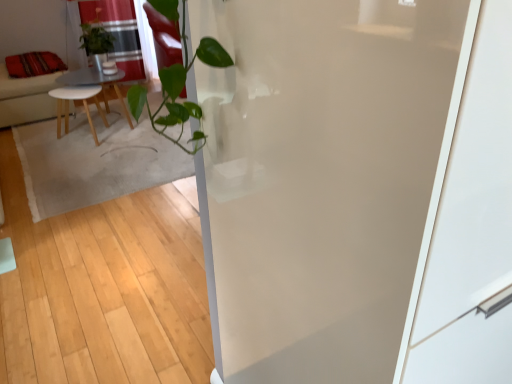
Question: Does wooden table at center come behind red fabric cushion at left?

Choices:
 (A) yes
 (B) no

Answer: (B)

Question: Is wooden table at center thinner than red fabric cushion at left?

Choices:
 (A) yes
 (B) no

Answer: (A)

Question: Is red fabric cushion at left a part of wooden table at center?

Choices:
 (A) no
 (B) yes

Answer: (A)

Question: From the image's perspective, does wooden table at center appear higher than red fabric cushion at left?

Choices:
 (A) yes
 (B) no

Answer: (B)

Question: Is the depth of wooden table at center less than that of red fabric cushion at left?

Choices:
 (A) no
 (B) yes

Answer: (B)

Question: Is point (110, 77) positioned closer to the camera than point (279, 117)?

Choices:
 (A) closer
 (B) farther

Answer: (B)

Question: Is wooden table at center bigger or smaller than transparent glass screen door at center?

Choices:
 (A) small
 (B) big

Answer: (A)

Question: In the image, is wooden table at center positioned in front of or behind transparent glass screen door at center?

Choices:
 (A) behind
 (B) front

Answer: (A)

Question: Which is correct: wooden table at center is inside transparent glass screen door at center, or outside of it?

Choices:
 (A) inside
 (B) outside

Answer: (B)

Question: From a real-world perspective, is velvet red pillow at upper left physically located above or below transparent glass screen door at center?

Choices:
 (A) above
 (B) below

Answer: (A)

Question: In terms of height, does velvet red pillow at upper left look taller or shorter compared to transparent glass screen door at center?

Choices:
 (A) tall
 (B) short

Answer: (B)

Question: Is velvet red pillow at upper left inside or outside of transparent glass screen door at center?

Choices:
 (A) inside
 (B) outside

Answer: (B)

Question: Based on their positions, is velvet red pillow at upper left located to the left or right of transparent glass screen door at center?

Choices:
 (A) right
 (B) left

Answer: (B)

Question: Relative to red sheer curtain at upper left, is wooden table at center in front or behind?

Choices:
 (A) front
 (B) behind

Answer: (A)

Question: Choose the correct answer: Is wooden table at center inside red sheer curtain at upper left or outside it?

Choices:
 (A) inside
 (B) outside

Answer: (B)